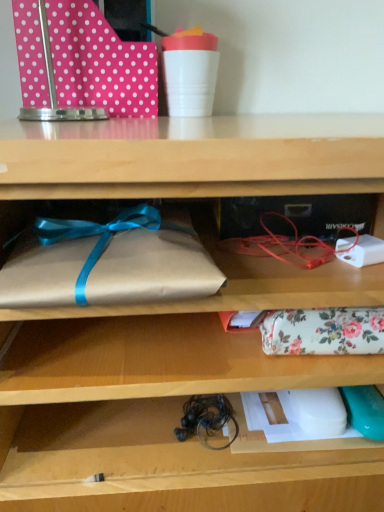
Question: From a real-world perspective, is brown paper wrapped at left, acting as the 2th wrap starting from the back, under black rubber twine at lower center?

Choices:
 (A) no
 (B) yes

Answer: (A)

Question: Is brown paper wrapped at left, acting as the 2th wrap starting from the back, to the right of black rubber twine at lower center from the viewer's perspective?

Choices:
 (A) no
 (B) yes

Answer: (A)

Question: Considering the relative sizes of brown paper wrapped at left, which is the first wrap from left to right, and black rubber twine at lower center in the image provided, is brown paper wrapped at left, which is the first wrap from left to right, bigger than black rubber twine at lower center?

Choices:
 (A) yes
 (B) no

Answer: (A)

Question: From the image's perspective, is brown paper wrapped at left, which is the 2th wrap from bottom to top, located beneath black rubber twine at lower center?

Choices:
 (A) yes
 (B) no

Answer: (B)

Question: Does brown paper wrapped at left, which is counted as the 2th wrap, starting from the right, have a greater width compared to black rubber twine at lower center?

Choices:
 (A) yes
 (B) no

Answer: (A)

Question: From a real-world perspective, relative to black rubber twine at lower center, is floral fabric pouch at center, marked as the first wrap in a bottom-to-top arrangement, vertically above or below?

Choices:
 (A) above
 (B) below

Answer: (A)

Question: From the image's perspective, is floral fabric pouch at center, marked as the first wrap in a bottom-to-top arrangement, above or below black rubber twine at lower center?

Choices:
 (A) above
 (B) below

Answer: (A)

Question: Relative to black rubber twine at lower center, is floral fabric pouch at center, which is the first wrap in back-to-front order, in front or behind?

Choices:
 (A) behind
 (B) front

Answer: (B)

Question: Does point (345, 313) appear closer or farther from the camera than point (188, 399)?

Choices:
 (A) closer
 (B) farther

Answer: (A)

Question: Based on their sizes in the image, would you say brown paper wrapped at left, acting as the 2th wrap starting from the back, is bigger or smaller than pink polka dot wrapping paper at upper left?

Choices:
 (A) big
 (B) small

Answer: (B)

Question: Does point (64, 222) appear closer or farther from the camera than point (77, 12)?

Choices:
 (A) closer
 (B) farther

Answer: (A)

Question: From their relative heights in the image, would you say brown paper wrapped at left, which is the 2th wrap from bottom to top, is taller or shorter than pink polka dot wrapping paper at upper left?

Choices:
 (A) tall
 (B) short

Answer: (B)

Question: Relative to pink polka dot wrapping paper at upper left, is brown paper wrapped at left, which is counted as the 2th wrap, starting from the right, in front or behind?

Choices:
 (A) behind
 (B) front

Answer: (B)

Question: From a real-world perspective, is pink polka dot wrapping paper at upper left above or below brown paper wrapped at left, which is the 1th wrap from front to back?

Choices:
 (A) below
 (B) above

Answer: (B)

Question: Which is correct: pink polka dot wrapping paper at upper left is inside brown paper wrapped at left, acting as the 1th wrap starting from the top, or outside of it?

Choices:
 (A) outside
 (B) inside

Answer: (A)